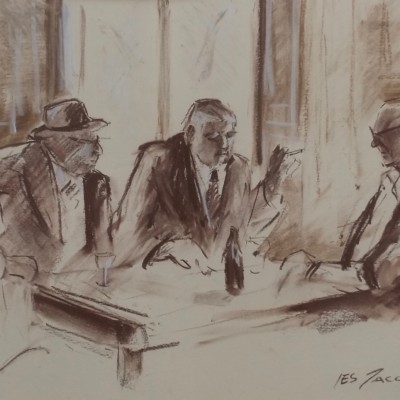
Find the location of `bottle`. bottle is located at coordinates (235, 258).